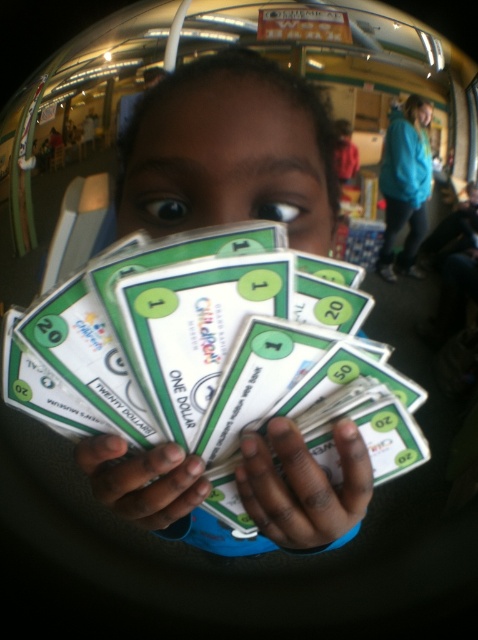
You are a visitor at the Children Museum in Grand Rapids. You see a person holding a fan of matte green paper money at center and a smooth skin face at center. Which object is closer to you?

The matte green paper money at center is positioned under the smooth skin face at center, so the smooth skin face at center is closer to you.